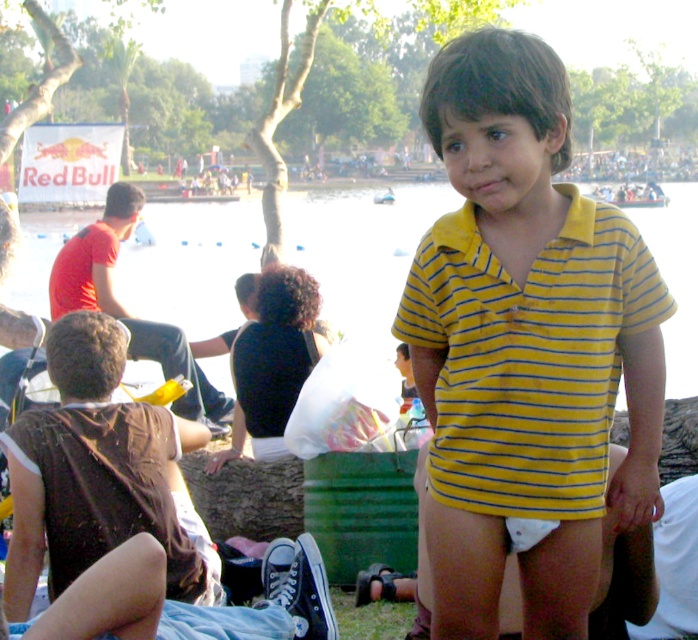
Who is lower down, yellow striped shirt at center or transparent plastic water at center?

yellow striped shirt at center

Is point (584, 433) positioned after point (244, 204)?

No.

This screenshot has width=698, height=640. In order to click on yellow striped shirt at center in this screenshot , I will do `click(526, 348)`.